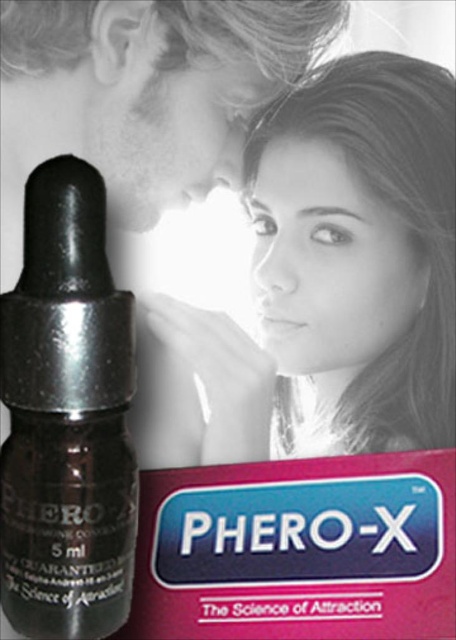
You are a photographer reviewing the advertisement for Phero X. You notice a point at coordinates [342,266]. Based on the description, where is this point located on the image?

Result: The point at coordinates [342,266] is located on the smooth skin face at upper center.

Looking at the advertisement for Phero X, you see a smooth skin face at upper center and a matte black lipstick at center. Which object is positioned more to the right?

The smooth skin face at upper center is positioned to the right of the matte black lipstick at center.